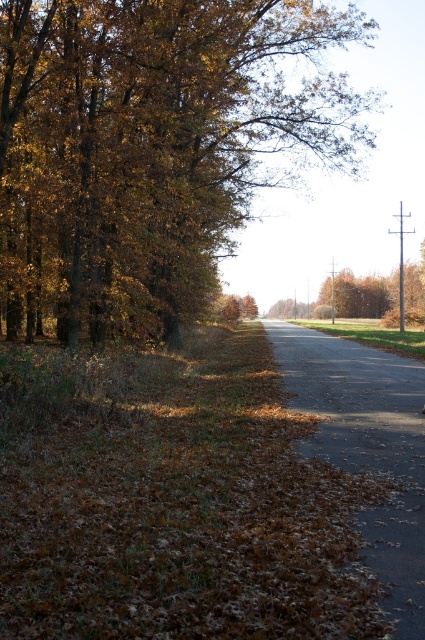
Question: Which of the following is the closest to the observer?

Choices:
 (A) gravel road at center
 (B) brown leafy tree at left

Answer: (A)

Question: Does brown leafy tree at left appear under gravel road at center?

Choices:
 (A) no
 (B) yes

Answer: (A)

Question: Is the position of brown leafy tree at left more distant than that of gravel road at center?

Choices:
 (A) yes
 (B) no

Answer: (A)

Question: Does brown leafy tree at left appear over gravel road at center?

Choices:
 (A) yes
 (B) no

Answer: (A)

Question: Which point is closer to the camera?

Choices:
 (A) brown leafy tree at left
 (B) gravel road at center

Answer: (B)

Question: Which object appears farthest from the camera in this image?

Choices:
 (A) brown leafy tree at left
 (B) gravel road at center

Answer: (A)